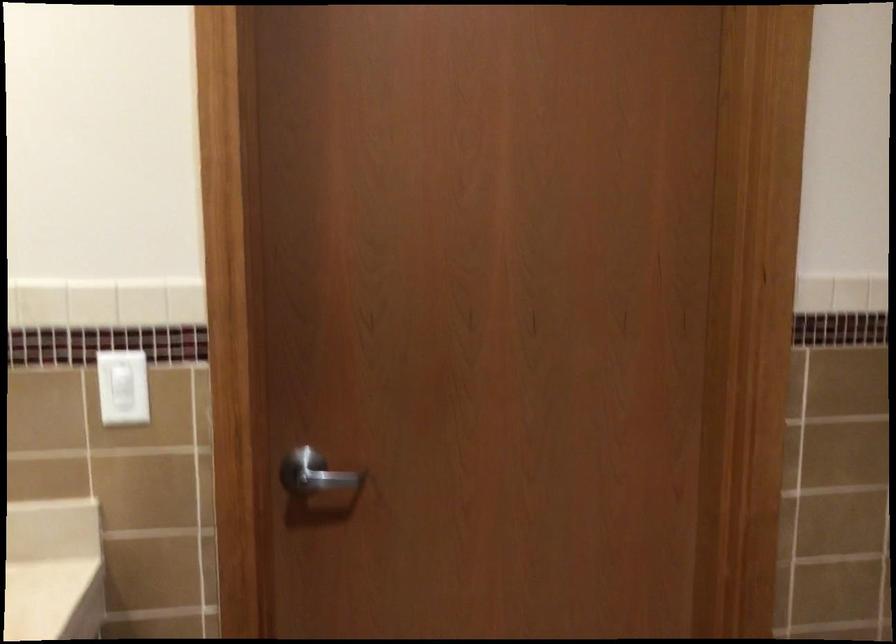
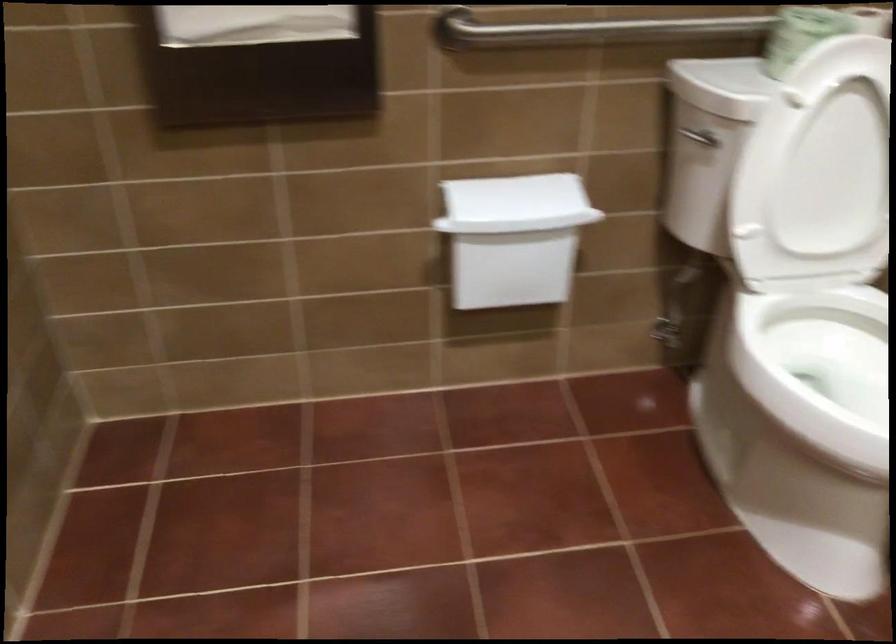
The first image is from the beginning of the video and the second image is from the end. How did the camera likely rotate when shooting the video?

The camera rotated toward right-down.